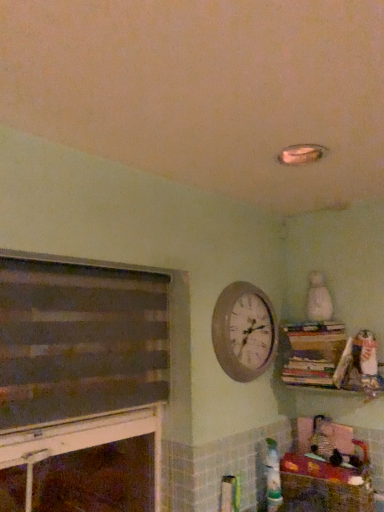
Question: Does point (145, 377) appear closer or farther from the camera than point (339, 355)?

Choices:
 (A) farther
 (B) closer

Answer: (B)

Question: Considering the relative positions of dark gray matte fireplace at left and wooden bookshelf at upper right in the image provided, is dark gray matte fireplace at left to the left or to the right of wooden bookshelf at upper right?

Choices:
 (A) left
 (B) right

Answer: (A)

Question: Which is nearer to the wooden bookshelf at upper right?

Choices:
 (A) wooden crate at lower right
 (B) dark gray matte fireplace at left
 (C) wooden wall clock at upper center
 (D) white plush bear at upper right

Answer: (D)

Question: Which object is the farthest from the wooden crate at lower right?

Choices:
 (A) wooden wall clock at upper center
 (B) dark gray matte fireplace at left
 (C) wooden bookshelf at upper right
 (D) white plush bear at upper right

Answer: (B)